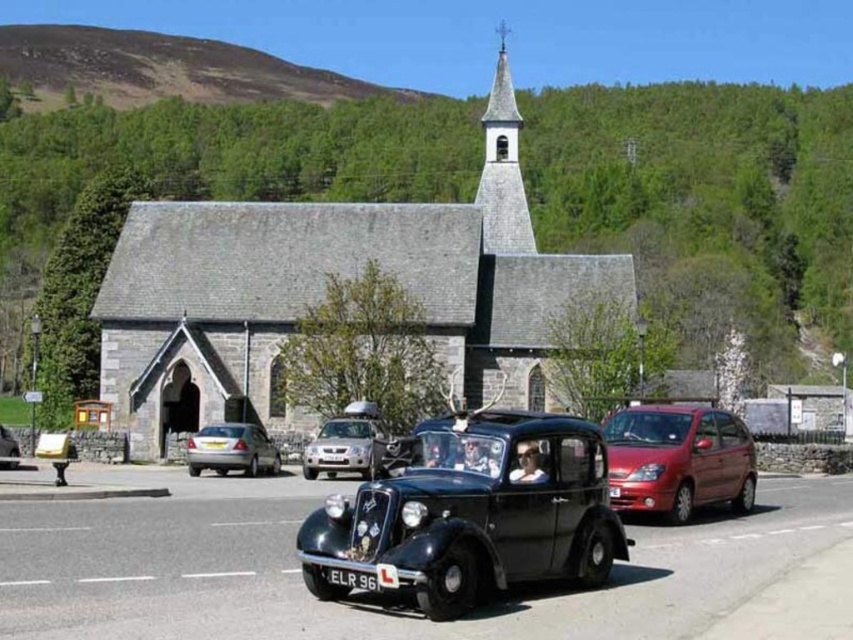
Between smooth gray steeple at upper center and silver metallic sedan at center, which one has more height?

With more height is smooth gray steeple at upper center.

Is smooth gray steeple at upper center below silver metallic sedan at center?

No.

Describe the element at coordinates (502, 168) in the screenshot. I see `smooth gray steeple at upper center` at that location.

Locate an element on the screen. The width and height of the screenshot is (853, 640). smooth gray steeple at upper center is located at coordinates (502, 168).

Does gray stone church at center appear over metallic silver car at center?

Indeed, gray stone church at center is positioned over metallic silver car at center.

You are a GUI agent. You are given a task and a screenshot of the screen. Output one action in this format:
    pyautogui.click(x=<x>, y=<y>)
    Task: Click on the gray stone church at center
    Image resolution: width=853 pixels, height=640 pixels.
    Given the screenshot: What is the action you would take?
    pyautogui.click(x=322, y=291)

Can you confirm if gray stone church at center is wider than smooth gray steeple at upper center?

Yes.

Is gray stone church at center to the right of smooth gray steeple at upper center from the viewer's perspective?

In fact, gray stone church at center is to the left of smooth gray steeple at upper center.

Locate an element on the screen. This screenshot has height=640, width=853. gray stone church at center is located at coordinates (322, 291).

This screenshot has height=640, width=853. I want to click on gray stone church at center, so click(322, 291).